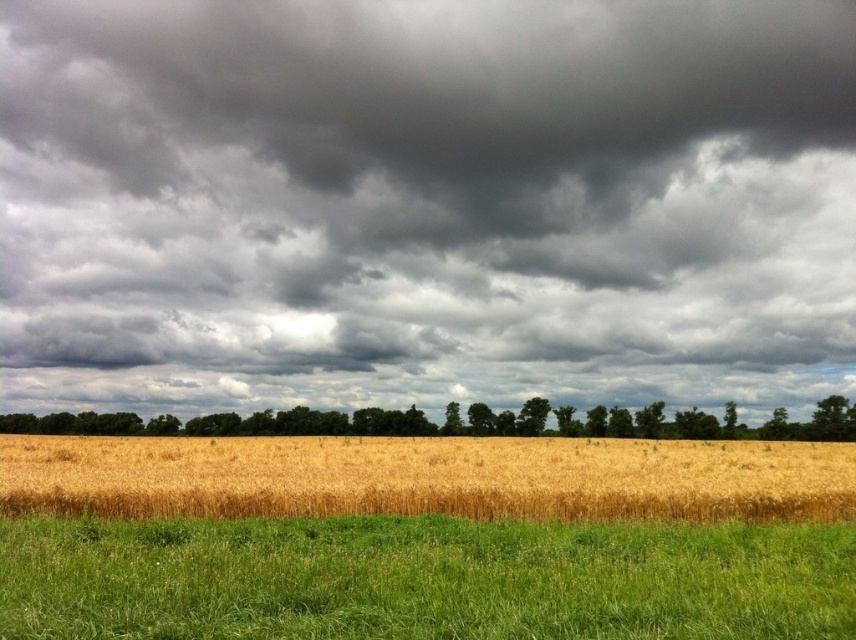
You are standing at the center of the image and want to reach the green grassy field at lower center. Which direction should you move in to get there?

You should move downward from the center to reach the green grassy field at lower center since it is located at point 0.905 on the x and 0.495 on the y coordinate.

You are a farmer planning to plant new crops. You have two areas to choose from in the image. Which area has a narrower space for planting? Please refer to the green grassy field at lower center and the green leafy trees at center.

The green grassy field at lower center is thinner than the green leafy trees at center, so the green grassy field at lower center has a narrower space for planting.